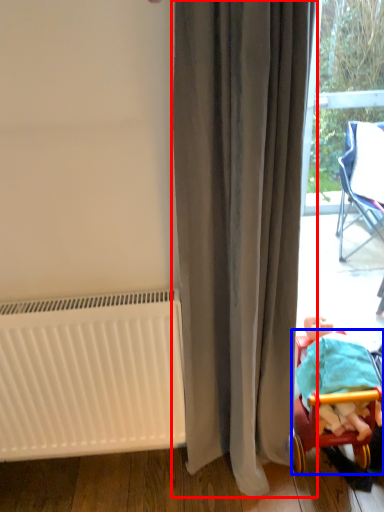
Question: Among these objects, which one is farthest to the camera, curtain (highlighted by a red box) or furniture (highlighted by a blue box)?

Choices:
 (A) curtain
 (B) furniture

Answer: (B)